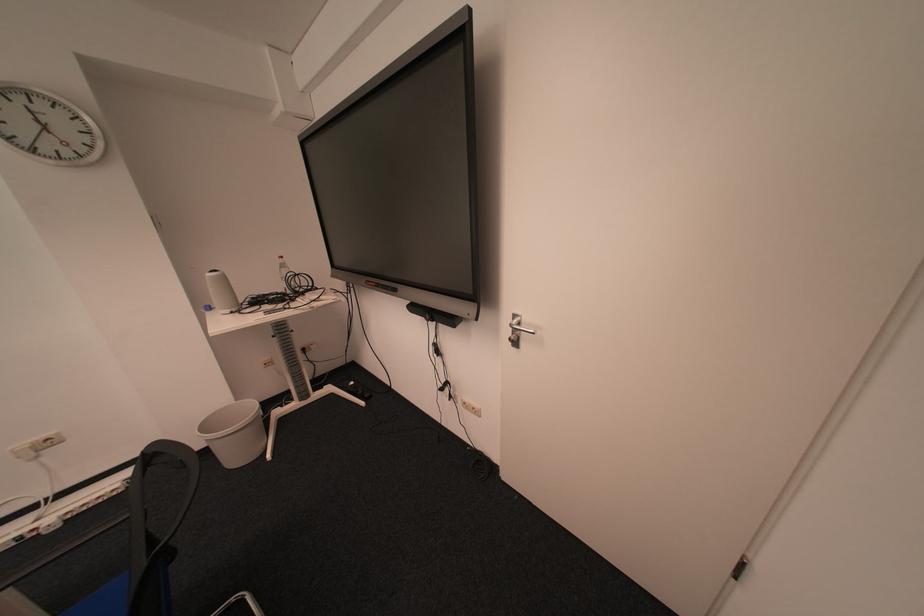
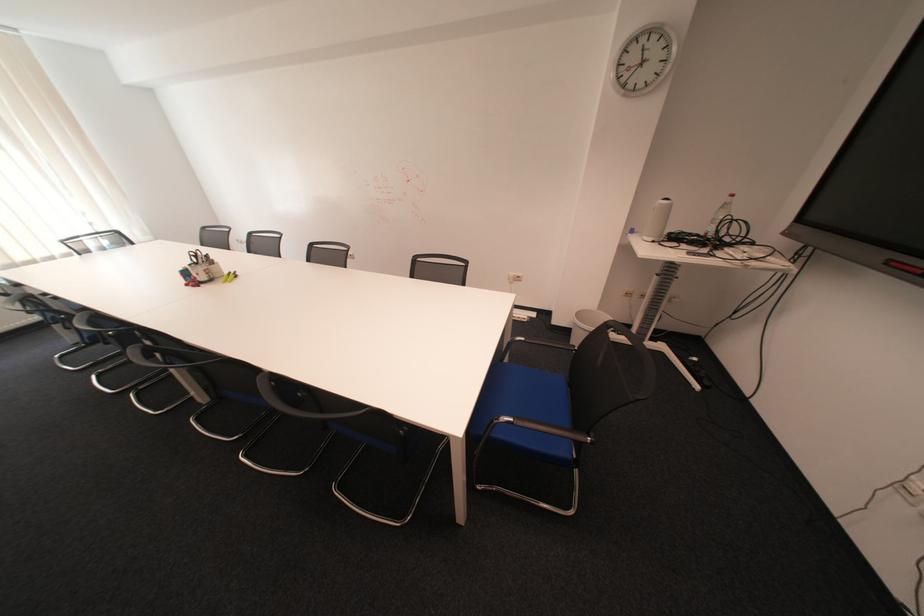
In the second image, find the point that corresponds to (x=216, y=426) in the first image.

(590, 315)